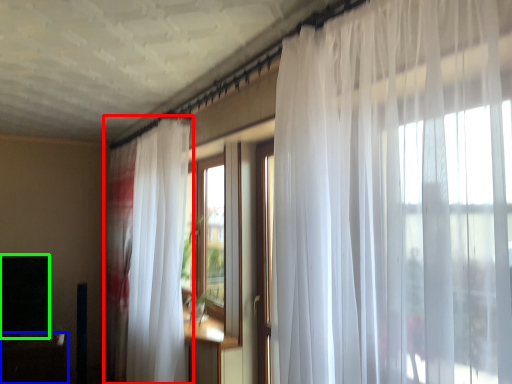
Question: Which object is positioned closest to curtain (highlighted by a red box)? Select from table (highlighted by a blue box) and window screen (highlighted by a green box).

Choices:
 (A) table
 (B) window screen

Answer: (B)